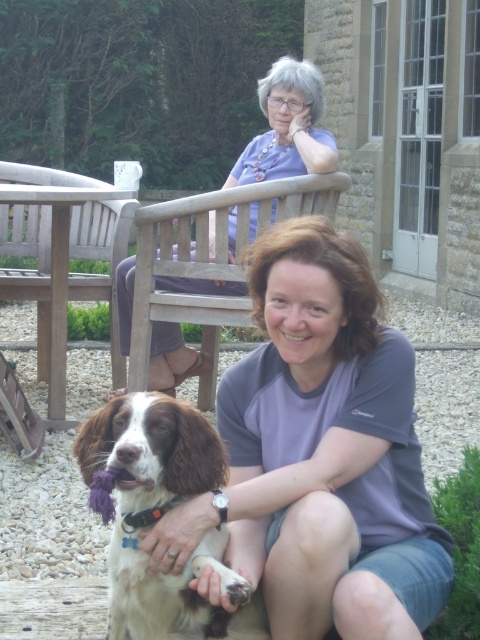
Which is more to the right, wooden park bench at upper center or matte purple blouse at upper center?

matte purple blouse at upper center

Who is more distant from viewer, (2,209) or (205,289)?

Point (2,209)

The image size is (480, 640). What do you see at coordinates (61, 259) in the screenshot?
I see `wooden park bench at upper center` at bounding box center [61, 259].

The height and width of the screenshot is (640, 480). Identify the location of wooden park bench at upper center. (61, 259).

Is white fur dog at lower left smaller than wooden park bench at upper center?

Yes.

Who is more forward, (134,611) or (90,243)?

Point (134,611)

The height and width of the screenshot is (640, 480). What do you see at coordinates (159, 516) in the screenshot?
I see `white fur dog at lower left` at bounding box center [159, 516].

Identify the location of white fur dog at lower left. (159, 516).

Between white fur dog at lower left and matte purple blouse at upper center, which one has more height?

matte purple blouse at upper center

What do you see at coordinates (159, 516) in the screenshot? This screenshot has width=480, height=640. I see `white fur dog at lower left` at bounding box center [159, 516].

Is point (191, 620) positioned after point (321, 154)?

No, it is in front of (321, 154).

Identify the location of white fur dog at lower left. Image resolution: width=480 pixels, height=640 pixels. (159, 516).